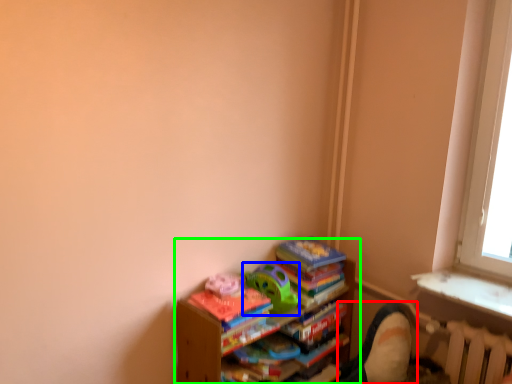
Question: Which object is the closest to the swivel chair (highlighted by a red box)? Choose among these: toy (highlighted by a blue box) or shelf (highlighted by a green box).

Choices:
 (A) toy
 (B) shelf

Answer: (B)